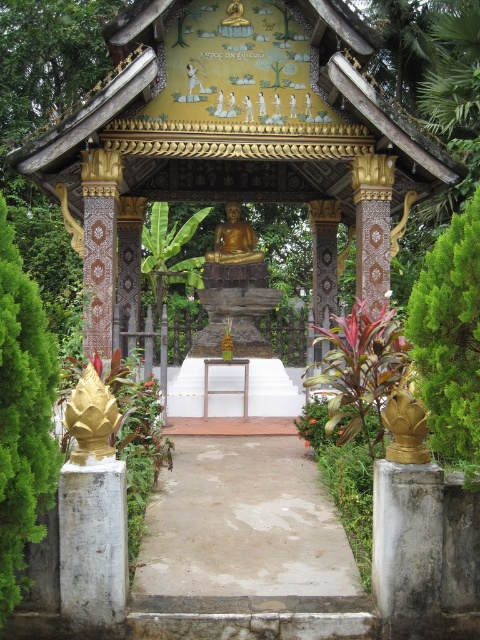
Question: Does green leafy bush at right appear under gold polished statue at center?

Choices:
 (A) yes
 (B) no

Answer: (A)

Question: Which point is farther from the camera taking this photo?

Choices:
 (A) (33, 410)
 (B) (468, 304)

Answer: (B)

Question: Can you confirm if concrete at center is bigger than green leafy bush at left?

Choices:
 (A) yes
 (B) no

Answer: (A)

Question: Observing the image, what is the correct spatial positioning of green leafy bush at left in reference to gold polished statue at center?

Choices:
 (A) left
 (B) right

Answer: (A)

Question: Which point is farther to the camera?

Choices:
 (A) (360, 115)
 (B) (9, 236)
 (C) (428, 275)
 (D) (243, 253)

Answer: (D)

Question: Considering the real-world distances, which object is closest to the green leafy bush at right?

Choices:
 (A) gold polished statue at center
 (B) green leafy bush at left
 (C) gold painted wood gazebo at center
 (D) concrete at center

Answer: (D)